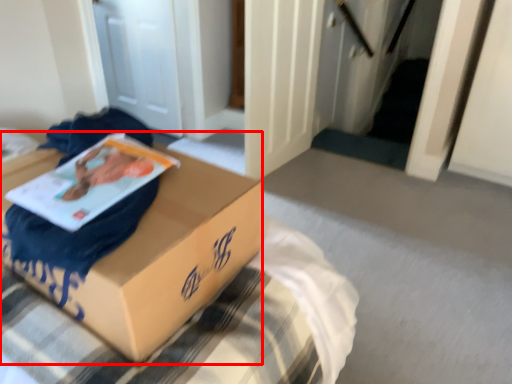
Question: From the image's perspective, where is box (annotated by the red box) located in relation to paperback book in the image?

Choices:
 (A) below
 (B) above

Answer: (A)